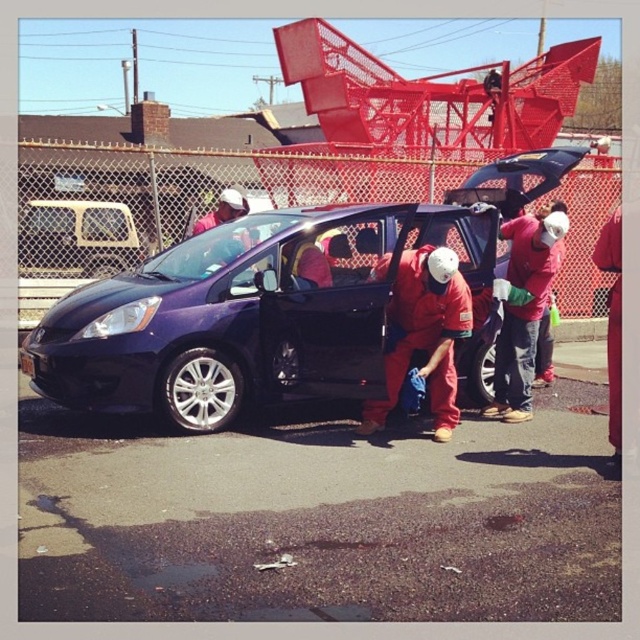
Does metallic silver minivan at left have a greater width compared to matte red shirt at center?

Correct, the width of metallic silver minivan at left exceeds that of matte red shirt at center.

Between metallic silver minivan at left and matte red shirt at center, which one appears on the right side from the viewer's perspective?

matte red shirt at center is more to the right.

Is point (48, 205) more distant than point (307, 272)?

Yes, it is behind point (307, 272).

Locate an element on the screen. This screenshot has width=640, height=640. metallic silver minivan at left is located at coordinates (68, 250).

In the scene shown: Between red matte jumpsuit at center and matte red helmet at center, which one appears on the left side from the viewer's perspective?

From the viewer's perspective, matte red helmet at center appears more on the left side.

Can you confirm if red matte jumpsuit at center is positioned above matte red helmet at center?

No, red matte jumpsuit at center is not above matte red helmet at center.

Who is more forward, (x=401, y=356) or (x=212, y=218)?

Point (x=401, y=356) is more forward.

Identify the location of red matte jumpsuit at center. The height and width of the screenshot is (640, 640). (424, 333).

What do you see at coordinates (244, 316) in the screenshot? The height and width of the screenshot is (640, 640). I see `purple matte car at center` at bounding box center [244, 316].

This screenshot has height=640, width=640. Identify the location of purple matte car at center. (244, 316).

Where is `purple matte car at center`? The height and width of the screenshot is (640, 640). purple matte car at center is located at coordinates (244, 316).